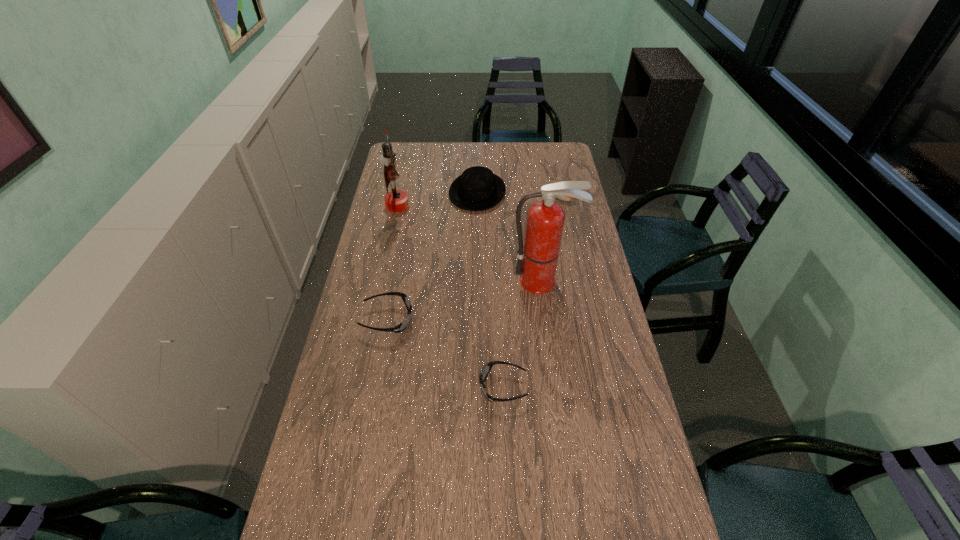
With all sunglassess evenly spaced, where should an extra sunglasses be placed on the right to continue the pattern? Please point out a vacant space. Please provide its 2D coordinates. Your answer should be formatted as a tuple, i.e. [(x, y)], where the tuple contains the x and y coordinates of a point satisfying the conditions above.

[(657, 476)]